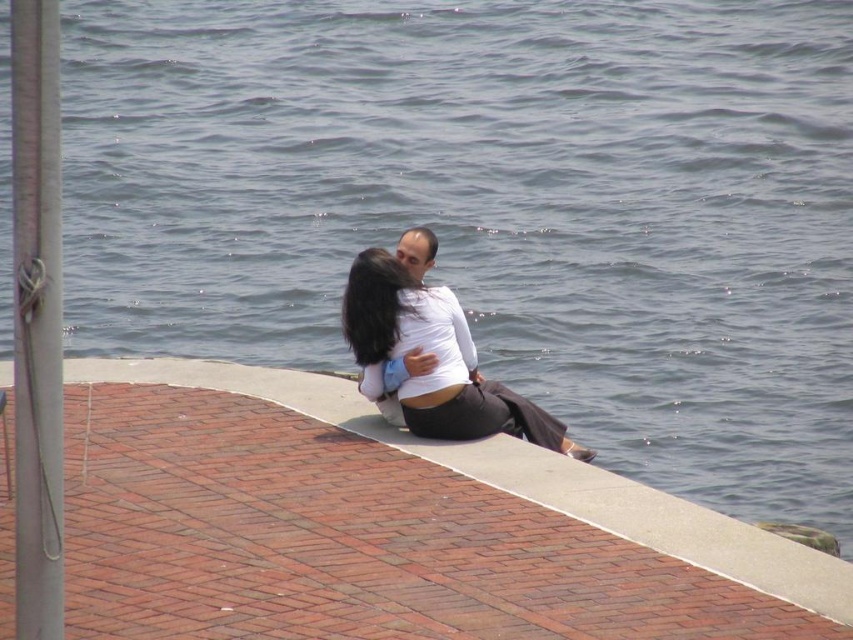
You are a maintenance worker needing to reach the metallic gray pole at left from the concrete ledge at center. Given that you have a 7.5 meter long tool, will you be able to reach the pole without moving from the ledge?

The concrete ledge at center and metallic gray pole at left are 8.02 meters apart from each other. Since your tool is only 7.5 meters long, it is shorter than the distance between them. Therefore, you will not be able to reach the metallic gray pole at left from the concrete ledge at center without moving.

You are an architect designing a new waterfront park and want to place a bench exactly where the concrete ledge at center is located. According to the image, what are the coordinates for placing the bench?

The coordinates for placing the bench should be at point (434, 513) since that is the 2D location of the concrete ledge at center.

You are standing at the edge of the water and want to sit down on the concrete ledge at center. Given that the ledge is at coordinates point 0.802, 0.510, can you estimate how far you need to walk from your current position to reach it?

The concrete ledge at center is located at point [434,513], so you need to walk approximately 0.8 meters horizontally and 0.5 meters vertically to reach it.